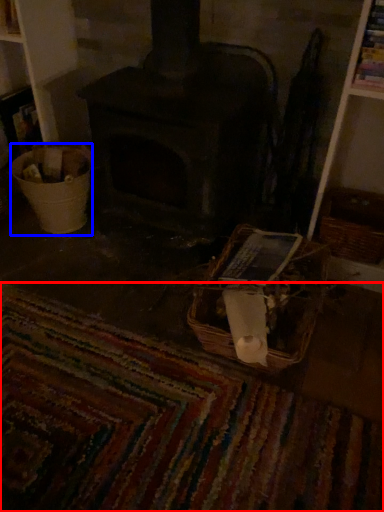
Question: Which of the following is the farthest to the observer, mat (highlighted by a red box) or basket container (highlighted by a blue box)?

Choices:
 (A) mat
 (B) basket container

Answer: (B)